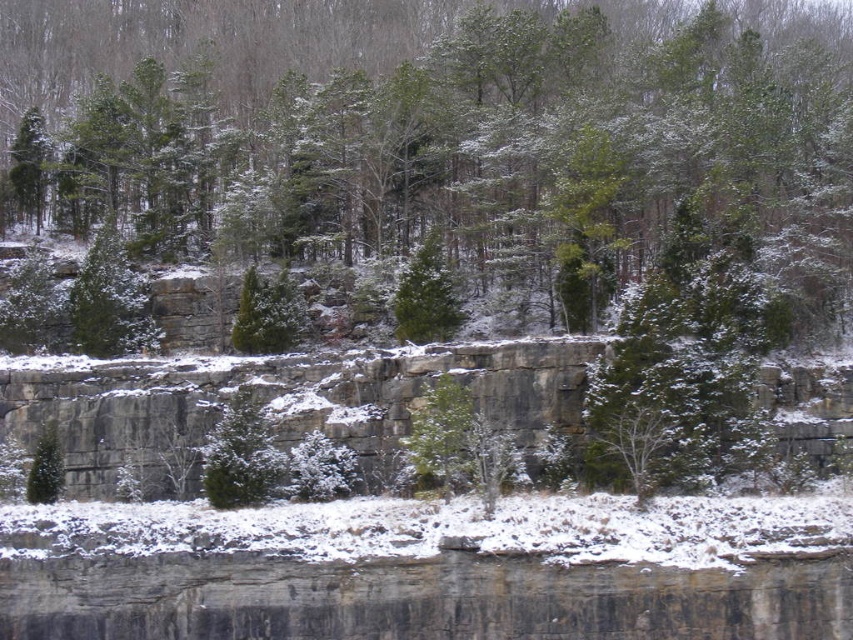
How distant is gray rock cliff at center from green matte tree at center?

gray rock cliff at center and green matte tree at center are 4.12 meters apart.

In the scene shown: Does gray rock cliff at center appear over green matte tree at center?

Actually, gray rock cliff at center is below green matte tree at center.

Measure the distance between gray rock cliff at center and camera.

gray rock cliff at center and camera are 47.12 meters apart from each other.

The height and width of the screenshot is (640, 853). In order to click on gray rock cliff at center in this screenshot , I will do (277, 403).